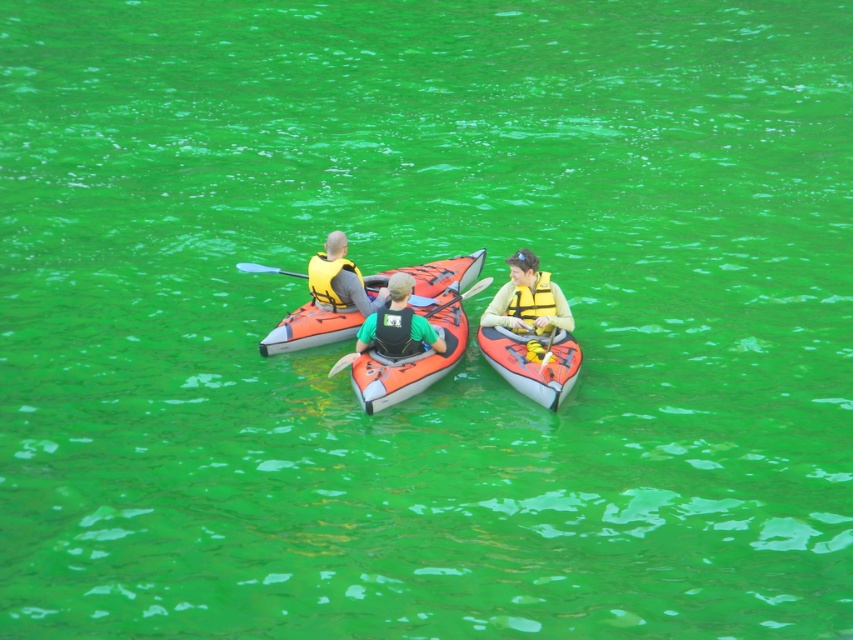
Question: Is orange matte kayak at center further to the viewer compared to smooth plastic paddle at center?

Choices:
 (A) no
 (B) yes

Answer: (A)

Question: Among these objects, which one is nearest to the camera?

Choices:
 (A) yellow foam paddle at lower center
 (B) smooth plastic paddle at center

Answer: (A)

Question: Which of the following is the farthest from the observer?

Choices:
 (A) yellow foam paddle at lower center
 (B) yellow matte life jacket at center
 (C) orange matte kayak at center

Answer: (B)

Question: Can you confirm if orange rubber canoe at center is smaller than yellow/textured life jacket at center?

Choices:
 (A) yes
 (B) no

Answer: (B)

Question: Which object is positioned closest to the yellow/textured life jacket at center?

Choices:
 (A) yellow foam paddle at lower center
 (B) matte orange kayak at center
 (C) orange rubber canoe at center
 (D) yellow life vest at center

Answer: (D)

Question: Does yellow matte life jacket at center appear on the right side of rubber paddle at center?

Choices:
 (A) yes
 (B) no

Answer: (B)